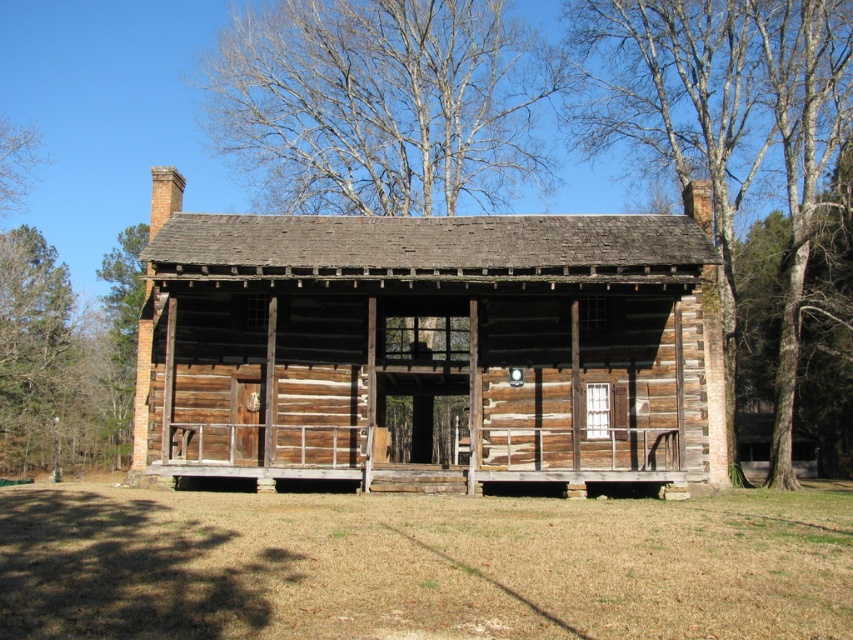
You are a visitor standing in front of the rustic log cabin. You notice the weathered wood porch at center and the bare branches at upper left. Which object takes up more space in the image?

The bare branches at upper left take up more space in the image because the weathered wood porch at center is smaller than bare branches at upper left.

You are planning to install a new solar panel system on the roof of the weathered wood porch at center. Considering the height of the brown rough bark tree at right, will the tree block sunlight from reaching the solar panels?

The brown rough bark tree at right is much taller than the weathered wood porch at center, so it may block sunlight from reaching the solar panels installed on the porch roof.

You are standing on the porch of the weathered wood log cabin at center and want to look up at the brown rough bark tree at right. Which direction should you look to see the tree above you?

The weathered wood log cabin at center is below the brown rough bark tree at right, so you should look upward toward the right to see the tree above you.